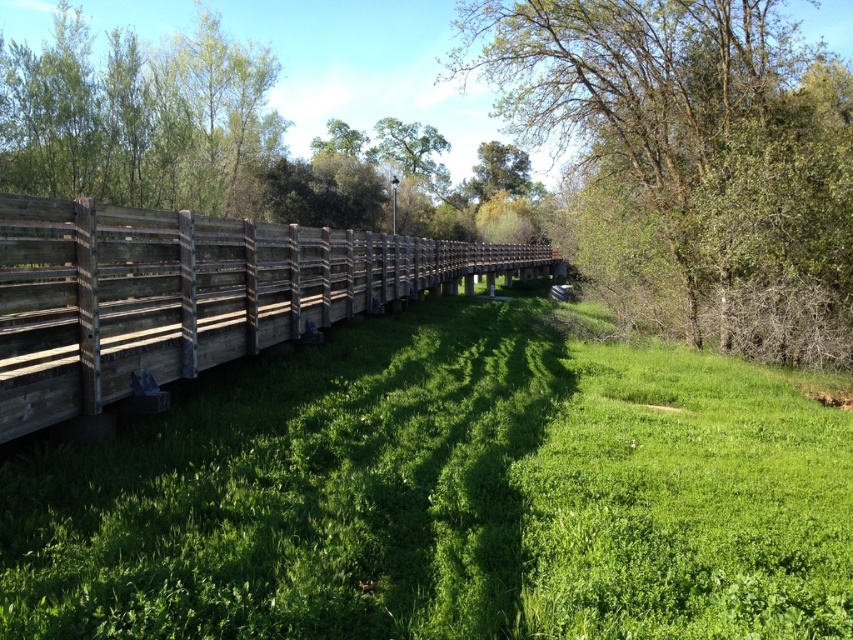
Consider the image. Does green grassy at left have a greater width compared to green leafy tree at upper center?

In fact, green grassy at left might be narrower than green leafy tree at upper center.

Is point (520, 534) closer to camera compared to point (485, 145)?

Yes, point (520, 534) is closer to viewer.

Locate an element on the screen. This screenshot has height=640, width=853. green grassy at left is located at coordinates (444, 496).

Between green grassy at left and weathered wood fence at left, which one appears on the left side from the viewer's perspective?

Positioned to the left is green grassy at left.

Who is higher up, green grassy at left or weathered wood fence at left?

Positioned higher is weathered wood fence at left.

Between point (839, 614) and point (4, 273), which one is positioned in front?

Point (839, 614)

The width and height of the screenshot is (853, 640). I want to click on green grassy at left, so click(444, 496).

Can you confirm if green grassy at left is positioned above green leafy tree at upper right?

No.

Can you confirm if green grassy at left is smaller than green leafy tree at upper right?

Yes.

Between point (297, 422) and point (762, 52), which one is positioned in front?

Point (297, 422)

The height and width of the screenshot is (640, 853). Find the location of `green grassy at left`. green grassy at left is located at coordinates (444, 496).